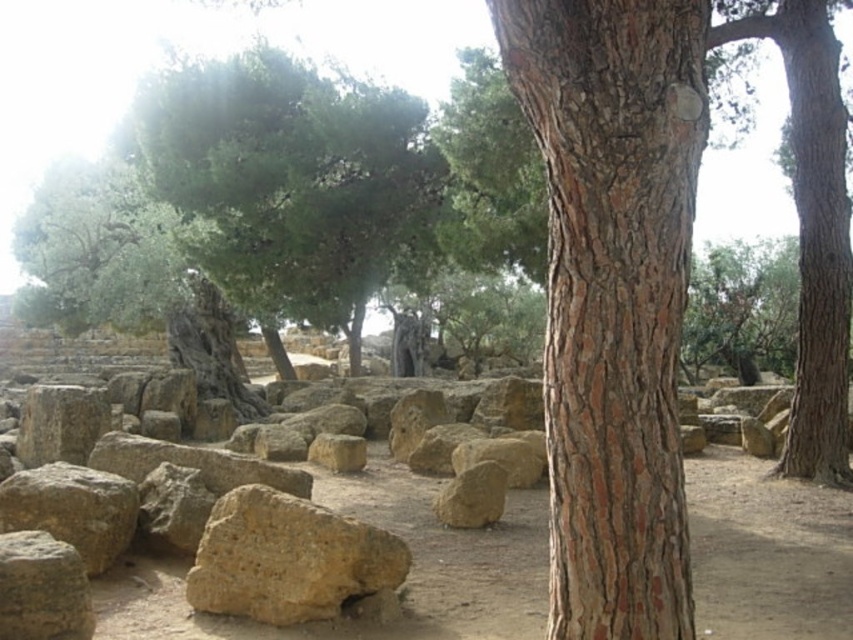
Question: In this image, where is brown rough rock at lower left located relative to yellowish stone at center?

Choices:
 (A) right
 (B) left

Answer: (B)

Question: Which object is positioned closest to the brown rough rock at center?

Choices:
 (A) brown rough stone at center
 (B) brown rough stone at lower left
 (C) brown dirt field at center

Answer: (C)

Question: Is brown dirt field at center thinner than brown rough stone at lower left?

Choices:
 (A) yes
 (B) no

Answer: (B)

Question: Which point appears closest to the camera in this image?

Choices:
 (A) click(x=676, y=321)
 (B) click(x=392, y=520)
 (C) click(x=325, y=468)
 (D) click(x=103, y=570)

Answer: (A)

Question: Among these objects, which one is nearest to the camera?

Choices:
 (A) brown rough rock at lower left
 (B) brown rough stone at lower left

Answer: (B)

Question: Is brown rough tree trunk at right positioned before brown rough rock at center?

Choices:
 (A) yes
 (B) no

Answer: (B)